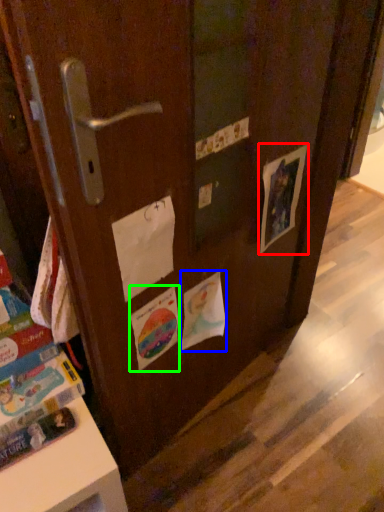
Question: Considering the real-world distances, which object is farthest from flyer (highlighted by a red box)? flyer (highlighted by a blue box) or flyer (highlighted by a green box)?

Choices:
 (A) flyer
 (B) flyer

Answer: (B)